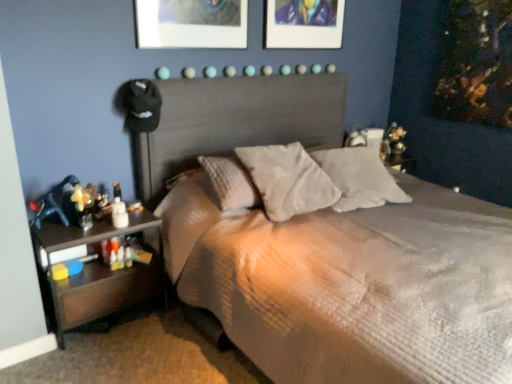
The width and height of the screenshot is (512, 384). Describe the element at coordinates (287, 180) in the screenshot. I see `textured gray pillow at center, positioned as the second pillow in right-to-left order` at that location.

Image resolution: width=512 pixels, height=384 pixels. What do you see at coordinates (362, 290) in the screenshot?
I see `textured gray bed at center` at bounding box center [362, 290].

Measure the distance between white soft pillow at center, the second pillow viewed from the left, and camera.

The distance of white soft pillow at center, the second pillow viewed from the left, from camera is 2.35 meters.

Identify the location of textured gray pillow at center, positioned as the second pillow in right-to-left order. The width and height of the screenshot is (512, 384). (287, 180).

Can you confirm if textured gray pillow at center, the first pillow when ordered from left to right, is bigger than black wood nightstand at lower left?

Incorrect, textured gray pillow at center, the first pillow when ordered from left to right, is not larger than black wood nightstand at lower left.

Is textured gray pillow at center, positioned as the second pillow in right-to-left order, turned away from black wood nightstand at lower left?

No, textured gray pillow at center, positioned as the second pillow in right-to-left order, is not facing away from black wood nightstand at lower left.

How many degrees apart are the facing directions of textured gray pillow at center, the first pillow when ordered from left to right, and black wood nightstand at lower left?

The facing directions of textured gray pillow at center, the first pillow when ordered from left to right, and black wood nightstand at lower left are 2.4 degrees apart.

Can you confirm if textured gray pillow at center, positioned as the second pillow in right-to-left order, is wider than black wood nightstand at lower left?

Correct, the width of textured gray pillow at center, positioned as the second pillow in right-to-left order, exceeds that of black wood nightstand at lower left.

Can you tell me how much textured gray pillow at center, the first pillow when ordered from left to right, and textured gray bed at center differ in facing direction?

textured gray pillow at center, the first pillow when ordered from left to right, and textured gray bed at center are facing 2.11 degrees away from each other.

Which is more to the left, textured gray pillow at center, positioned as the second pillow in right-to-left order, or textured gray bed at center?

textured gray pillow at center, positioned as the second pillow in right-to-left order.

Is textured gray bed at center surrounded by textured gray pillow at center, positioned as the second pillow in right-to-left order?

No, textured gray bed at center is located outside of textured gray pillow at center, positioned as the second pillow in right-to-left order.

Measure the distance from black wood nightstand at lower left to metallic silver picture frame at upper center.

black wood nightstand at lower left is 1.70 meters from metallic silver picture frame at upper center.

Does black wood nightstand at lower left appear on the right side of metallic silver picture frame at upper center?

In fact, black wood nightstand at lower left is to the left of metallic silver picture frame at upper center.

The width and height of the screenshot is (512, 384). What are the coordinates of `nightstand that is below the metallic silver picture frame at upper center (from the image's perspective)` in the screenshot? It's located at (102, 293).

Is black wood nightstand at lower left not inside metallic silver picture frame at upper center?

That's correct, black wood nightstand at lower left is outside of metallic silver picture frame at upper center.

From the image's perspective, is textured gray bed at center located above or below white soft pillow at center, which is the 1th pillow in right-to-left order?

Clearly, from the image's perspective, textured gray bed at center is below white soft pillow at center, which is the 1th pillow in right-to-left order.

Looking at this image, considering the relative sizes of textured gray bed at center and white soft pillow at center, the second pillow viewed from the left, in the image provided, is textured gray bed at center thinner than white soft pillow at center, the second pillow viewed from the left,?

No.

Is textured gray bed at center shorter than white soft pillow at center, the second pillow viewed from the left?

Incorrect, the height of textured gray bed at center does not fall short of that of white soft pillow at center, the second pillow viewed from the left.

Is textured gray bed at center positioned beyond the bounds of white soft pillow at center, the second pillow viewed from the left?

Yes.

Looking at this image, is textured gray bed at center surrounding textured gray pillow at center, the first pillow when ordered from left to right?

Yes, textured gray pillow at center, the first pillow when ordered from left to right, can be found within textured gray bed at center.

Which of these two, textured gray bed at center or textured gray pillow at center, positioned as the second pillow in right-to-left order, stands shorter?

With less height is textured gray pillow at center, positioned as the second pillow in right-to-left order.

Considering the relative positions of textured gray bed at center and textured gray pillow at center, positioned as the second pillow in right-to-left order, in the image provided, is textured gray bed at center to the left of textured gray pillow at center, positioned as the second pillow in right-to-left order, from the viewer's perspective?

No, textured gray bed at center is not to the left of textured gray pillow at center, positioned as the second pillow in right-to-left order.

Is white soft pillow at center, which is the 1th pillow in right-to-left order, looking in the opposite direction of black wood nightstand at lower left?

That's not correct — white soft pillow at center, which is the 1th pillow in right-to-left order, is not looking away from black wood nightstand at lower left.

Is white soft pillow at center, the second pillow viewed from the left, further to the viewer compared to black wood nightstand at lower left?

Yes, white soft pillow at center, the second pillow viewed from the left, is behind black wood nightstand at lower left.

In the scene shown: Are white soft pillow at center, the second pillow viewed from the left, and black wood nightstand at lower left making contact?

No, white soft pillow at center, the second pillow viewed from the left, is not with black wood nightstand at lower left.

This screenshot has height=384, width=512. There is a metallic silver picture frame at upper center. Find the location of `the 2nd pillow below it (from a real-world perspective)`. the 2nd pillow below it (from a real-world perspective) is located at coordinates (359, 178).

Is metallic silver picture frame at upper center positioned with its back to white soft pillow at center, which is the 1th pillow in right-to-left order?

metallic silver picture frame at upper center does not have its back to white soft pillow at center, which is the 1th pillow in right-to-left order.

Between metallic silver picture frame at upper center and white soft pillow at center, the second pillow viewed from the left, which one appears on the left side from the viewer's perspective?

From the viewer's perspective, metallic silver picture frame at upper center appears more on the left side.

Who is taller, metallic silver picture frame at upper center or white soft pillow at center, the second pillow viewed from the left?

Standing taller between the two is metallic silver picture frame at upper center.

Locate an element on the screen. pillow that is the 1st object located behind the black wood nightstand at lower left is located at coordinates click(287, 180).

The width and height of the screenshot is (512, 384). What are the coordinates of `bed that is below the textured gray pillow at center, the first pillow when ordered from left to right (from the image's perspective)` in the screenshot? It's located at (362, 290).

Based on their spatial positions, is textured gray pillow at center, positioned as the second pillow in right-to-left order, or textured gray bed at center further from metallic silver picture frame at upper center?

Based on the image, textured gray bed at center appears to be further to metallic silver picture frame at upper center.

Considering their positions, is white soft pillow at center, which is the 1th pillow in right-to-left order, positioned closer to metallic silver picture frame at upper center than black wood nightstand at lower left?

white soft pillow at center, which is the 1th pillow in right-to-left order, is closer to metallic silver picture frame at upper center.

Based on their spatial positions, is black wood nightstand at lower left or metallic silver picture frame at upper center further from white soft pillow at center, which is the 1th pillow in right-to-left order?

black wood nightstand at lower left is positioned further to the anchor white soft pillow at center, which is the 1th pillow in right-to-left order.

From the image, which object appears to be farther from textured gray pillow at center, the first pillow when ordered from left to right, white soft pillow at center, which is the 1th pillow in right-to-left order, or metallic silver picture frame at upper center?

Based on the image, metallic silver picture frame at upper center appears to be further to textured gray pillow at center, the first pillow when ordered from left to right.

Estimate the real-world distances between objects in this image. Which object is closer to textured gray pillow at center, the first pillow when ordered from left to right, metallic silver picture frame at upper center or black wood nightstand at lower left?

black wood nightstand at lower left is closer to textured gray pillow at center, the first pillow when ordered from left to right.

When comparing their distances from white soft pillow at center, the second pillow viewed from the left, does textured gray pillow at center, the first pillow when ordered from left to right, or textured gray bed at center seem closer?

The object closer to white soft pillow at center, the second pillow viewed from the left, is textured gray pillow at center, the first pillow when ordered from left to right.

Based on the photo, based on their spatial positions, is textured gray bed at center or white soft pillow at center, which is the 1th pillow in right-to-left order, further from black wood nightstand at lower left?

white soft pillow at center, which is the 1th pillow in right-to-left order, is further to black wood nightstand at lower left.

Consider the image. Considering their positions, is white soft pillow at center, which is the 1th pillow in right-to-left order, positioned closer to black wood nightstand at lower left than textured gray pillow at center, positioned as the second pillow in right-to-left order?

Based on the image, textured gray pillow at center, positioned as the second pillow in right-to-left order, appears to be nearer to black wood nightstand at lower left.

Find the location of a particular element. This screenshot has width=512, height=384. nightstand between textured gray bed at center and textured gray pillow at center, the first pillow when ordered from left to right, from front to back is located at coordinates (102, 293).

I want to click on pillow between textured gray bed at center and white soft pillow at center, which is the 1th pillow in right-to-left order, along the z-axis, so click(287, 180).

This screenshot has width=512, height=384. Find the location of `nightstand positioned between textured gray bed at center and metallic silver picture frame at upper center from near to far`. nightstand positioned between textured gray bed at center and metallic silver picture frame at upper center from near to far is located at coordinates (102, 293).

Where is `nightstand located between textured gray bed at center and white soft pillow at center, the second pillow viewed from the left, in the depth direction`? This screenshot has width=512, height=384. nightstand located between textured gray bed at center and white soft pillow at center, the second pillow viewed from the left, in the depth direction is located at coordinates (102, 293).